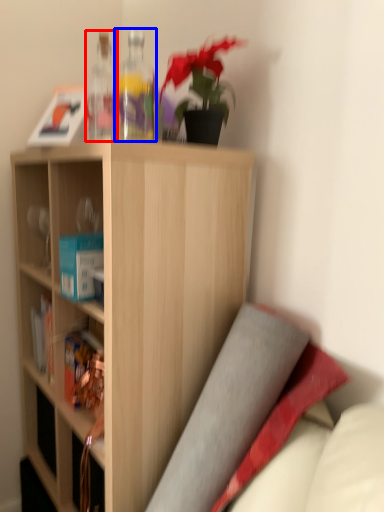
Question: Which object appears farthest to the camera in this image, bottle (highlighted by a red box) or bottle (highlighted by a blue box)?

Choices:
 (A) bottle
 (B) bottle

Answer: (A)